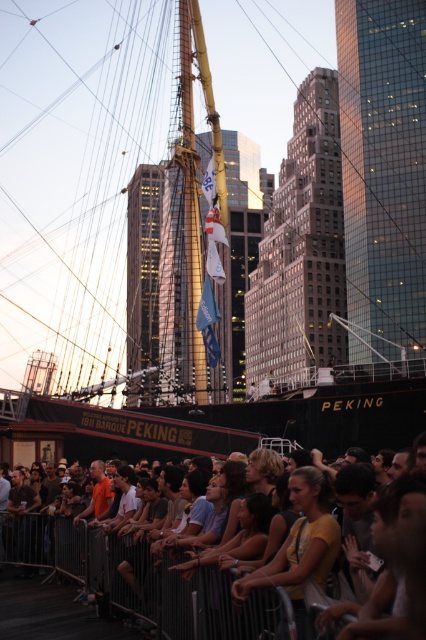
Question: Can you confirm if black matte ship at center is positioned to the right of matte yellow shirt at center?

Choices:
 (A) no
 (B) yes

Answer: (A)

Question: Does black matte ship at center appear on the left side of matte yellow shirt at center?

Choices:
 (A) no
 (B) yes

Answer: (B)

Question: Which point is closer to the camera?

Choices:
 (A) tap(89, 282)
 (B) tap(118, 588)

Answer: (B)

Question: Among these objects, which one is nearest to the camera?

Choices:
 (A) black matte ship at center
 (B) matte yellow shirt at center

Answer: (B)

Question: Which point is farther to the camera?

Choices:
 (A) matte yellow shirt at center
 (B) black matte ship at center

Answer: (B)

Question: Does black matte ship at center have a greater width compared to matte yellow shirt at center?

Choices:
 (A) no
 (B) yes

Answer: (B)